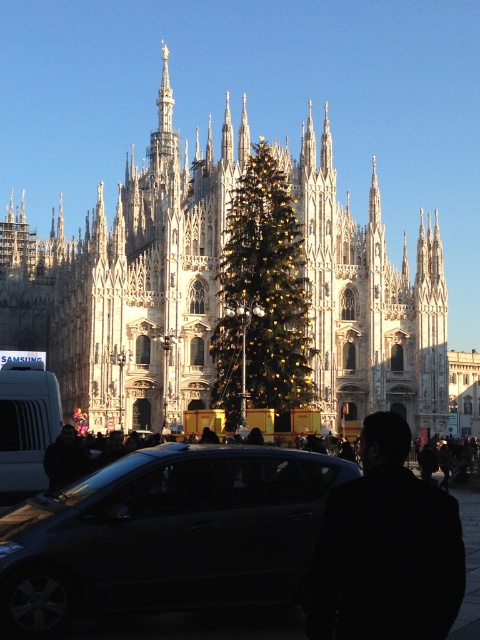
Who is more forward, [168,156] or [48,385]?

Positioned in front is point [48,385].

Does point (342, 221) come closer to viewer compared to point (6, 371)?

That is False.

What do you see at coordinates (130, 284) in the screenshot? The height and width of the screenshot is (640, 480). I see `white stone church at center` at bounding box center [130, 284].

You are a GUI agent. You are given a task and a screenshot of the screen. Output one action in this format:
    pyautogui.click(x=<x>, y=<y>)
    Task: Click on the white stone church at center
    The height and width of the screenshot is (640, 480).
    Given the screenshot: What is the action you would take?
    pyautogui.click(x=130, y=284)

Between white stone church at center and gold/golden/ornate christmas tree at center, which one has more height?

Standing taller between the two is white stone church at center.

Which is in front, point (55, 289) or point (289, 262)?

Positioned in front is point (289, 262).

Find the location of `white stone church at center`. white stone church at center is located at coordinates (130, 284).

Is gold/golden/ornate christmas tree at center above matte silver van at left?

Yes, gold/golden/ornate christmas tree at center is above matte silver van at left.

Who is more distant from viewer, (241,292) or (45,385)?

The point (241,292) is behind.

Where is `gold/golden/ornate christmas tree at center`? This screenshot has width=480, height=640. gold/golden/ornate christmas tree at center is located at coordinates (263, 296).